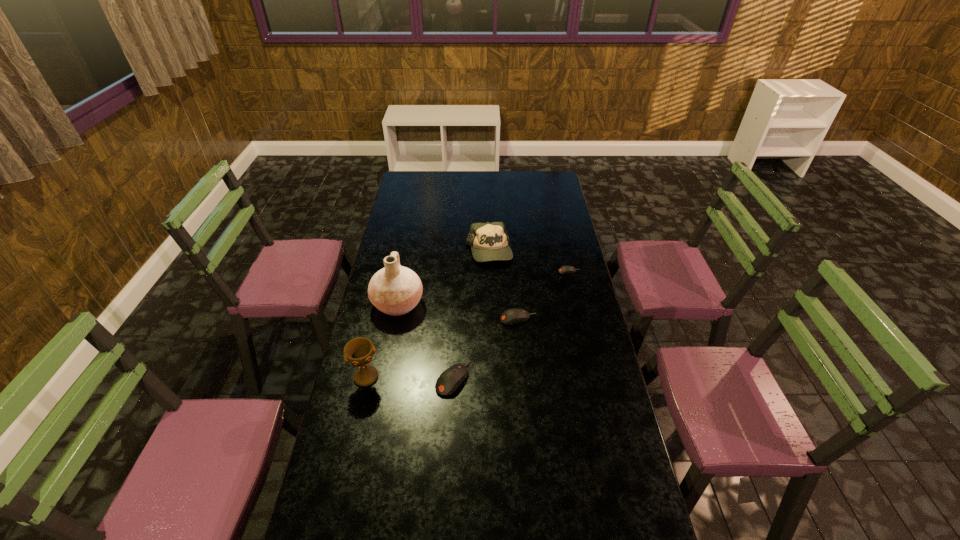
The height and width of the screenshot is (540, 960). I want to click on empty space that is in between the second nearest computer mouse and the rightmost object, so coord(543,295).

In order to click on free space that is in between the second tallest object and the rightmost computer mouse in this screenshot , I will do `click(468, 324)`.

Select which object appears as the third closest to the rightmost computer mouse. Please provide its 2D coordinates. Your answer should be formatted as a tuple, i.e. [(x, y)], where the tuple contains the x and y coordinates of a point satisfying the conditions above.

[(395, 290)]

I want to click on the closest object to the fourth shortest object, so click(x=566, y=269).

Locate which computer mouse is the second closest to the fifth tallest object. Please provide its 2D coordinates. Your answer should be formatted as a tuple, i.e. [(x, y)], where the tuple contains the x and y coordinates of a point satisfying the conditions above.

[(566, 269)]

Find the location of a particular element. computer mouse identified as the second closest to the leftmost computer mouse is located at coordinates (566, 269).

At what (x,y) coordinates should I click in order to perform the action: click on vacant region that satisfies the following two spatial constraints: 1. on the front-facing side of the farthest object; 2. on the right side of the second computer mouse from left to right. Please return your answer as a coordinate pair (x, y). This screenshot has width=960, height=540. Looking at the image, I should click on point(491,319).

Identify the location of vacant space that satisfies the following two spatial constraints: 1. on the back side of the second computer mouse from left to right; 2. on the right side of the farthest computer mouse. (515, 272).

Locate an element on the screen. This screenshot has width=960, height=540. vacant position in the image that satisfies the following two spatial constraints: 1. on the front-facing side of the shortest computer mouse; 2. on the left side of the baseball cap is located at coordinates point(490,272).

This screenshot has width=960, height=540. I want to click on vacant point that satisfies the following two spatial constraints: 1. on the front-facing side of the baseball cap; 2. on the right side of the shortest computer mouse, so click(490, 272).